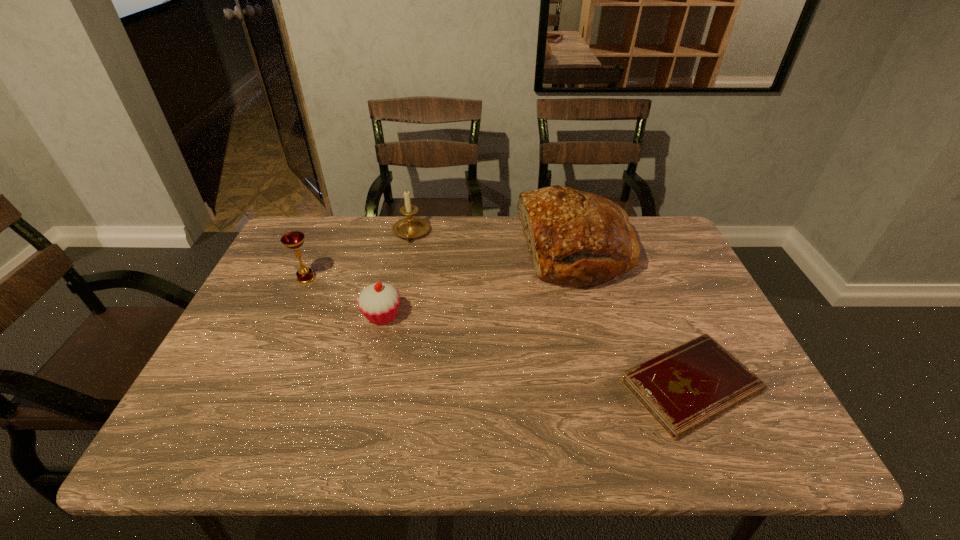
Identify the location of object present at the far right corner. (576, 237).

This screenshot has width=960, height=540. Find the location of `object positioned at the near right corner`. object positioned at the near right corner is located at coordinates click(x=691, y=384).

Where is `free space at the far edge of the desktop`? The height and width of the screenshot is (540, 960). free space at the far edge of the desktop is located at coordinates (376, 234).

The height and width of the screenshot is (540, 960). I want to click on free space at the near edge of the desktop, so [666, 437].

Locate an element on the screen. Image resolution: width=960 pixels, height=540 pixels. free spot at the far left corner of the desktop is located at coordinates (309, 238).

Image resolution: width=960 pixels, height=540 pixels. I want to click on vacant region at the far right corner of the desktop, so click(637, 221).

Locate an element on the screen. free region at the near right corner of the desktop is located at coordinates (740, 425).

Identify the location of free space between the nearest object and the cupcake. The height and width of the screenshot is (540, 960). (537, 351).

Image resolution: width=960 pixels, height=540 pixels. I want to click on vacant area between the tallest object and the second nearest object, so click(479, 283).

The height and width of the screenshot is (540, 960). Identify the location of vacant space that's between the nearest object and the cupcake. (537, 351).